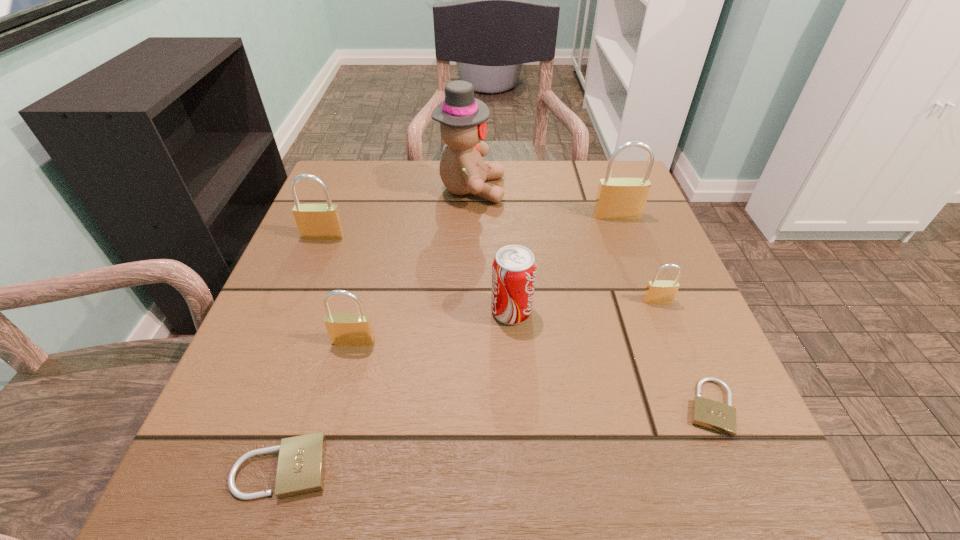
Point out which brass padlock is positioned as the third nearest to the red soda can. Please provide its 2D coordinates. Your answer should be formatted as a tuple, i.e. [(x, y)], where the tuple contains the x and y coordinates of a point satisfying the conditions above.

[(617, 198)]

Find the location of a particular element. Image resolution: width=960 pixels, height=540 pixels. free location that satisfies the following two spatial constraints: 1. on the front-facing side of the tallest object; 2. on the front-facing side of the fourth farthest padlock is located at coordinates (467, 341).

Identify the location of blank space that satisfies the following two spatial constraints: 1. on the front-facing side of the right beige padlock; 2. on the right side of the third shortest padlock. (699, 407).

Identify the location of free region that satisfies the following two spatial constraints: 1. on the back side of the shortest object; 2. on the front-facing side of the rag_doll. (620, 189).